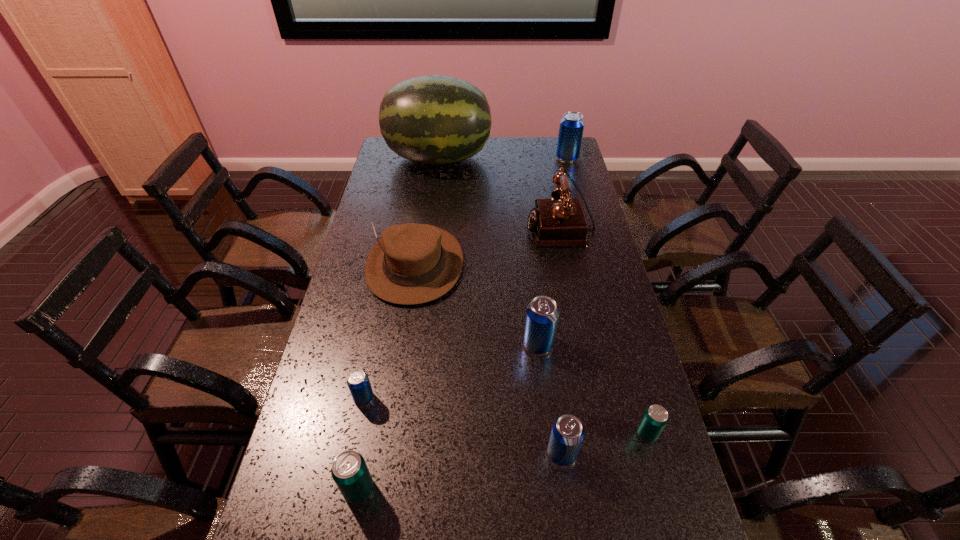
Find the location of `vacant area that lies between the tallest beer can and the fourth nearest object`. vacant area that lies between the tallest beer can and the fourth nearest object is located at coordinates (466, 278).

What are the coordinates of `vacant area that lies between the nearest object and the nearest blue beer can` in the screenshot? It's located at (460, 471).

The height and width of the screenshot is (540, 960). Identify the location of vacant space in between the nearest blue beer can and the biggest blue beer can. (564, 306).

I want to click on vacant area that lies between the nearest blue beer can and the farthest beer can, so click(x=564, y=306).

At what (x,y) coordinates should I click in order to perform the action: click on vacant point located between the farther teal beer can and the telephone. Please return your answer as a coordinate pair (x, y). The image size is (960, 540). Looking at the image, I should click on click(604, 330).

Identify which object is located as the eighth nearest to the left teal beer can. Please provide its 2D coordinates. Your answer should be formatted as a tuple, i.e. [(x, y)], where the tuple contains the x and y coordinates of a point satisfying the conditions above.

[(571, 128)]

Select which object is the eighth closest to the brown telephone. Please provide its 2D coordinates. Your answer should be formatted as a tuple, i.e. [(x, y)], where the tuple contains the x and y coordinates of a point satisfying the conditions above.

[(349, 470)]

Where is `the third closest beer can to the smaller teal beer can`? The image size is (960, 540). the third closest beer can to the smaller teal beer can is located at coordinates (349, 470).

Identify the location of beer can that is the fifth closest one to the bigger teal beer can. This screenshot has width=960, height=540. (571, 128).

Locate an element on the screen. blue beer can that is the second nearest to the second nearest blue beer can is located at coordinates (567, 433).